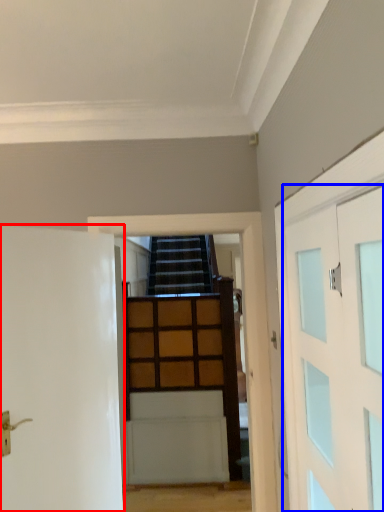
Question: Which object appears closest to the camera in this image, door (highlighted by a red box) or door (highlighted by a blue box)?

Choices:
 (A) door
 (B) door

Answer: (B)